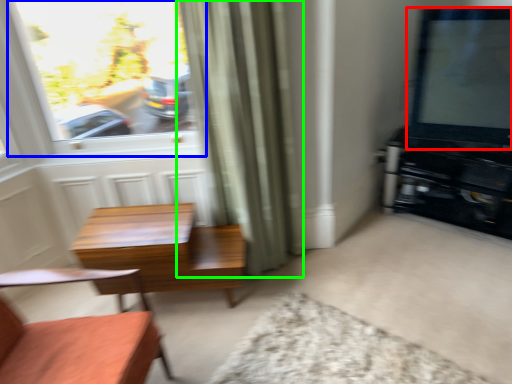
Question: Which object is positioned closest to window screen (highlighted by a red box)? Select from window (highlighted by a blue box) and curtain (highlighted by a green box).

Choices:
 (A) window
 (B) curtain

Answer: (B)